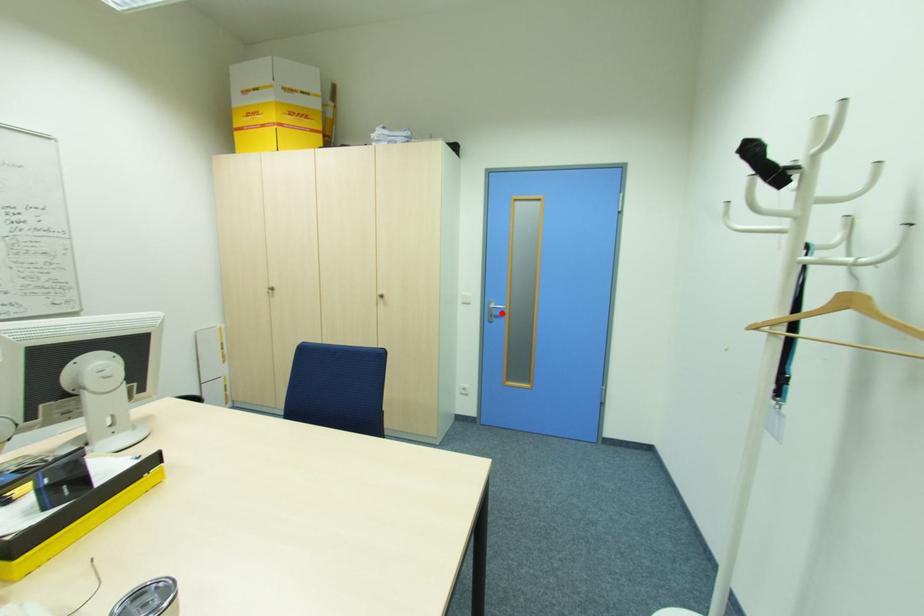
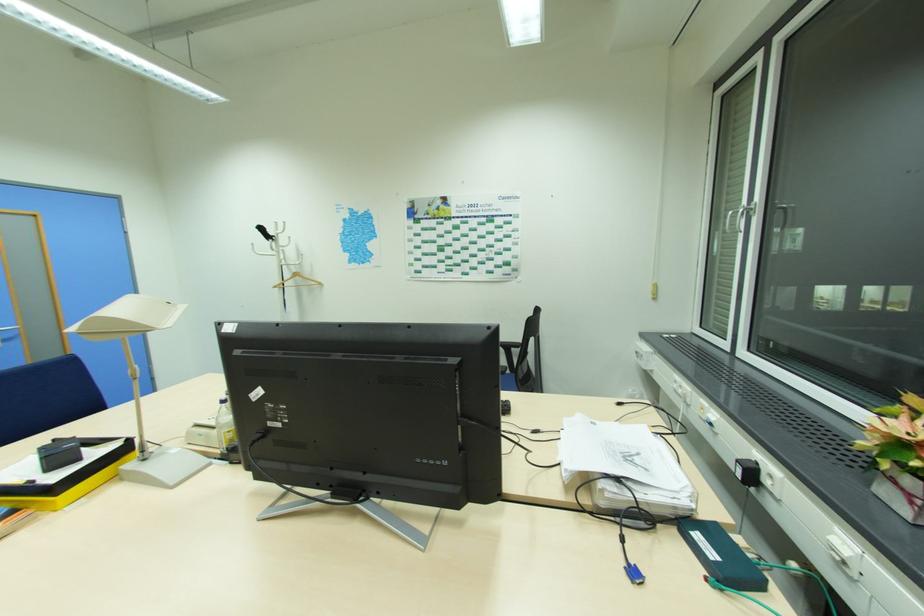
Question: I am providing you with two images of the same scene from different viewpoints. A red point is shown in image1. For the corresponding object point in image2, is it positioned nearer or farther from the camera?

Choices:
 (A) Nearer
 (B) Farther

Answer: (B)